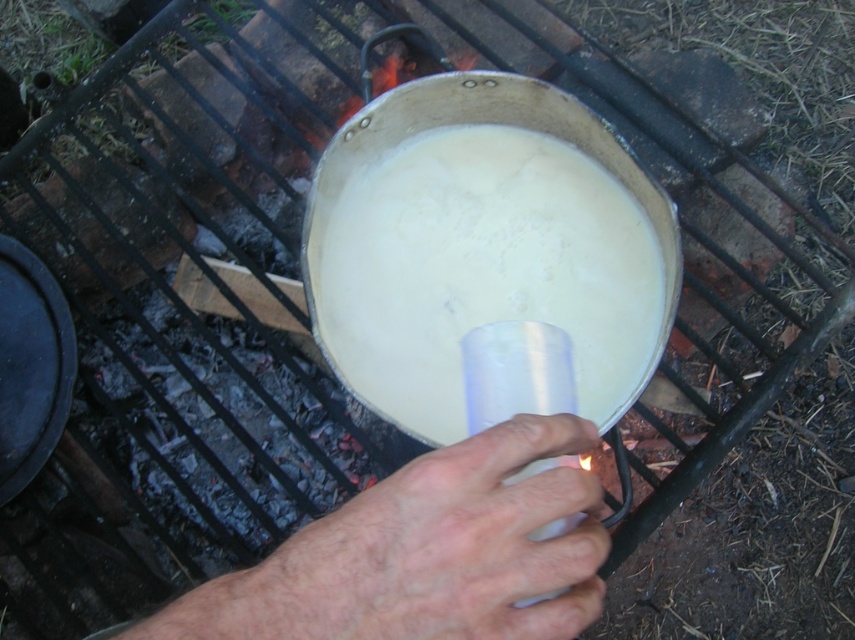
Does white matte liquid at center lie behind dry skin at center?

That is True.

Which is above, white matte liquid at center or dry skin at center?

white matte liquid at center

Who is more forward, (329, 266) or (410, 467)?

Point (410, 467) is more forward.

Find the location of `white matte liquid at center`. white matte liquid at center is located at coordinates (484, 269).